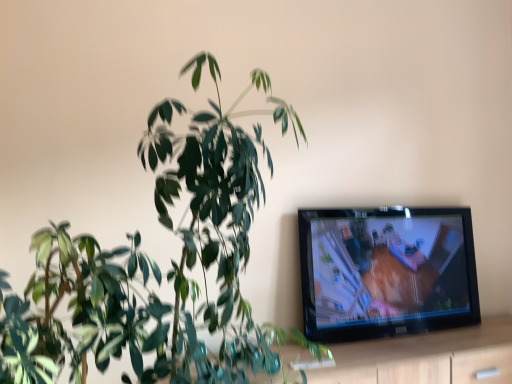
Question: Would you say light wood dresser at lower right is inside or outside green glossy plant at left?

Choices:
 (A) inside
 (B) outside

Answer: (B)

Question: Looking at the image, does light wood dresser at lower right seem bigger or smaller compared to green glossy plant at left?

Choices:
 (A) big
 (B) small

Answer: (B)

Question: Visually, is light wood dresser at lower right positioned to the left or to the right of green glossy plant at left?

Choices:
 (A) left
 (B) right

Answer: (B)

Question: In terms of size, does green glossy plant at left appear bigger or smaller than light wood dresser at lower right?

Choices:
 (A) big
 (B) small

Answer: (A)

Question: Is green glossy plant at left taller or shorter than light wood dresser at lower right?

Choices:
 (A) tall
 (B) short

Answer: (A)

Question: Is green glossy plant at left wider or thinner than light wood dresser at lower right?

Choices:
 (A) thin
 (B) wide

Answer: (B)

Question: From a real-world perspective, is green glossy plant at left above or below light wood dresser at lower right?

Choices:
 (A) above
 (B) below

Answer: (A)